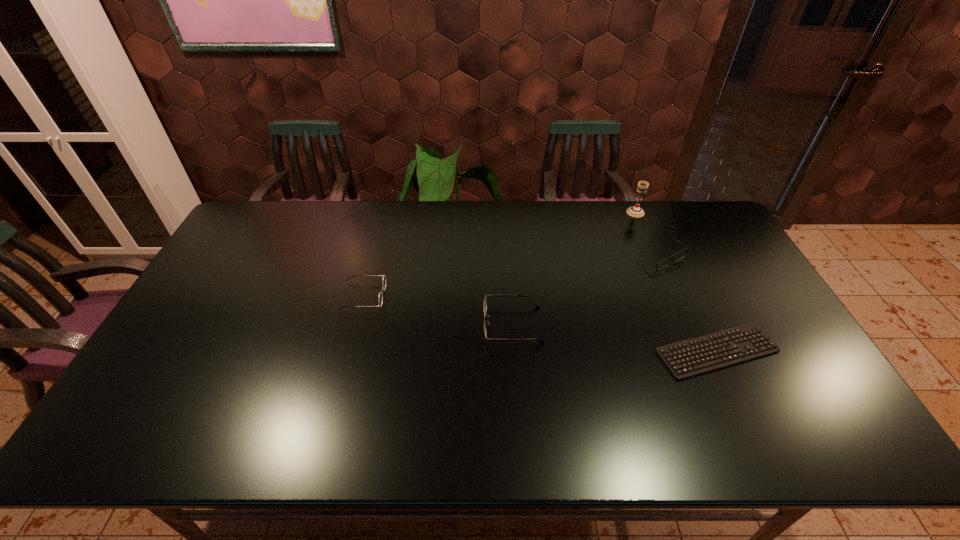
Where is `vacant position in the image that satisfies the following two spatial constraints: 1. with the lenses facing outward on the fourth nearest object; 2. on the front-facing side of the shortest spectacles`? vacant position in the image that satisfies the following two spatial constraints: 1. with the lenses facing outward on the fourth nearest object; 2. on the front-facing side of the shortest spectacles is located at coordinates (690, 325).

At what (x,y) coordinates should I click in order to perform the action: click on vacant region that satisfies the following two spatial constraints: 1. with the lenses facing outward on the second farthest object; 2. on the front-facing side of the leftmost spectacles. Please return your answer as a coordinate pair (x, y). Looking at the image, I should click on (678, 296).

This screenshot has width=960, height=540. Identify the location of vacant position in the image that satisfies the following two spatial constraints: 1. on the front side of the shortest object; 2. on the left side of the chalice. [695, 351].

You are a GUI agent. You are given a task and a screenshot of the screen. Output one action in this format:
    pyautogui.click(x=<x>, y=<y>)
    Task: Click on the vacant area in the image that satisfies the following two spatial constraints: 1. on the front-facing side of the shortest object; 2. on the left side of the second spectacles from left to right
    The height and width of the screenshot is (540, 960).
    Given the screenshot: What is the action you would take?
    pyautogui.click(x=515, y=351)